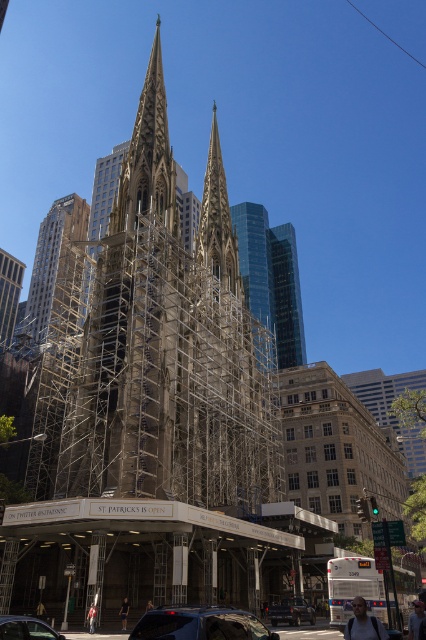
Is gold metallic spire at upper left behind glassy reflective skyscraper at right?

No, gold metallic spire at upper left is closer to the viewer.

Is point (68, 228) in front of point (281, 316)?

No, (68, 228) is behind (281, 316).

Locate an element on the screen. gold metallic spire at upper left is located at coordinates (52, 257).

Can you confirm if gold metallic spire at upper left is shorter than matte black car at lower left?

Incorrect, gold metallic spire at upper left's height does not fall short of matte black car at lower left's.

Is point (48, 282) farther from viewer compared to point (9, 616)?

Yes, it is behind point (9, 616).

Is point (48, 237) positioned after point (5, 618)?

Yes.

The height and width of the screenshot is (640, 426). In order to click on gold metallic spire at upper left in this screenshot , I will do `click(52, 257)`.

Is gold metallic spire at upper left thinner than black matte car at lower center?

No, gold metallic spire at upper left is not thinner than black matte car at lower center.

Can you confirm if gold metallic spire at upper left is positioned to the left of black matte car at lower center?

Correct, you'll find gold metallic spire at upper left to the left of black matte car at lower center.

Find the location of a particular element. gold metallic spire at upper left is located at coordinates (52, 257).